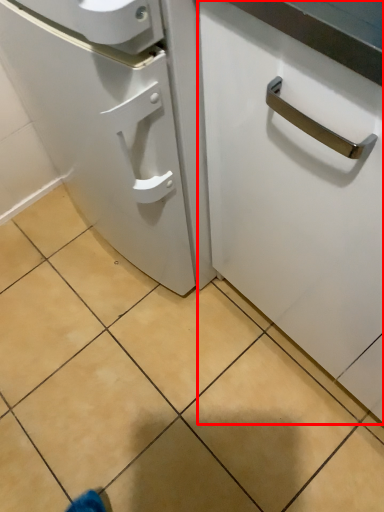
Question: In this image, where is cabinetry (annotated by the red box) located relative to tile?

Choices:
 (A) left
 (B) right

Answer: (B)